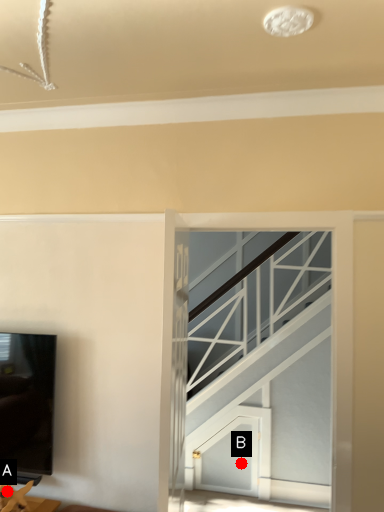
Question: Two points are circled on the image, labeled by A and B beside each circle. Among these points, which one is farthest from the camera?

Choices:
 (A) A is further
 (B) B is further

Answer: (B)